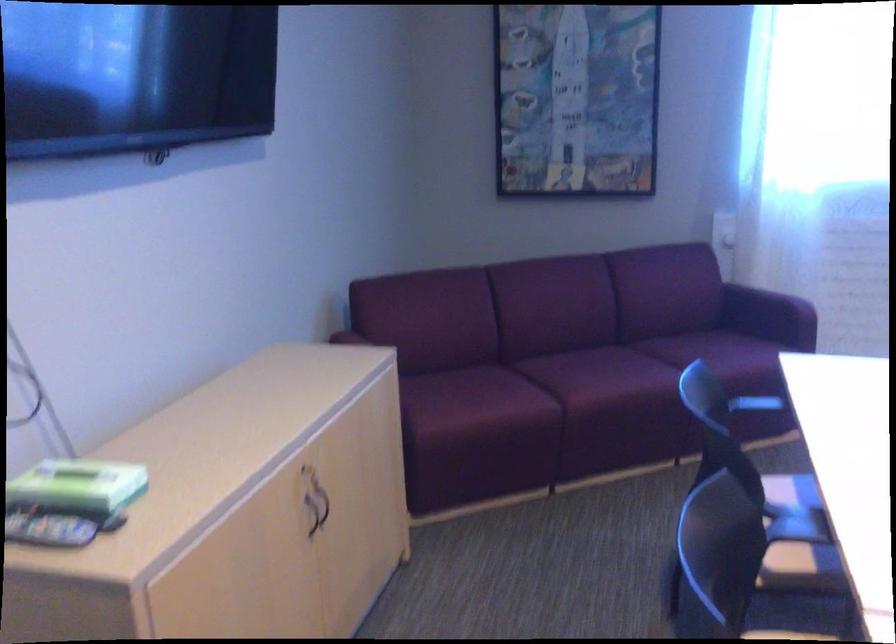
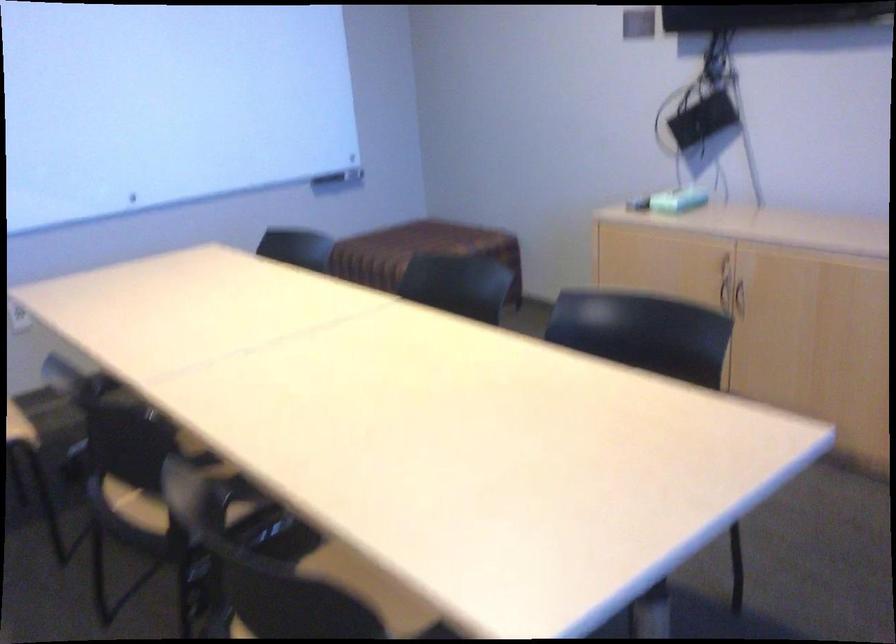
Find the pixel in the second image that matches point (98, 496) in the first image.

(677, 200)